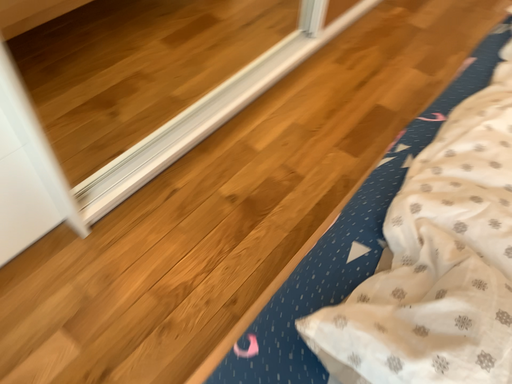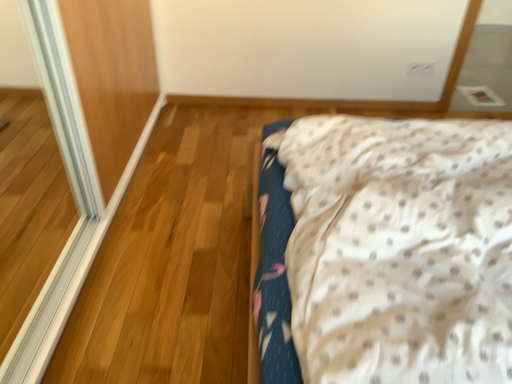
Question: Which way did the camera rotate in the video?

Choices:
 (A) rotated upward
 (B) rotated downward

Answer: (A)